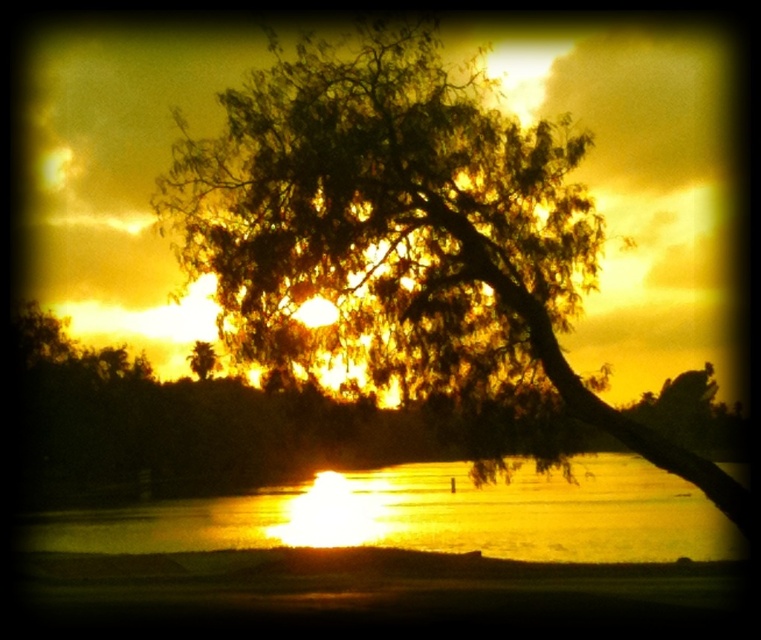
You are a photographer trying to capture the sunset reflection on the water. You notice the green leafy tree at center and the glistening water at center. Which object is closer to the camera, and why?

The green leafy tree at center is closer to the camera because it is positioned over the glistening water at center, meaning the tree is in front of the water.

You are standing in the sunset scene and want to place a small decorative rock. You have two points to choose from, point 1 at point (518, 180) and point 2 at point (414, 522). Which point is closer to you where you can place the rock?

Point 1 at point (518, 180) is closer to the viewer than point 2 at point (414, 522), so you should place the rock there.

You are an artist trying to paint the sunset scene. You want to ensure the green leafy tree at center and the glistening water at center are proportionally accurate. Which object should you make larger in your painting?

The glistening water at center should be made larger in the painting since it is larger than the green leafy tree at center according to the description.